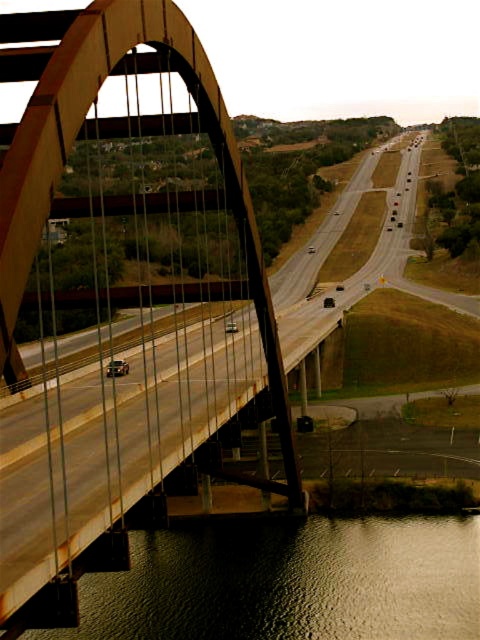
Does rusty metal pedestrian bridge at center lie in front of smooth brown water at lower center?

Yes.

Which is behind, point (271, 378) or point (262, 570)?

Positioned behind is point (262, 570).

Identify the location of rusty metal pedestrian bridge at center. This screenshot has width=480, height=640. (120, 300).